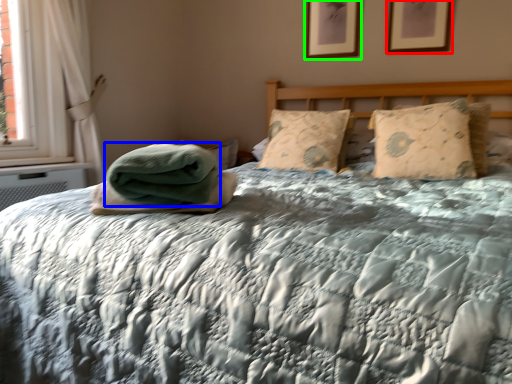
Question: Which object is the closest to the picture frame (highlighted by a red box)? Choose among these: material (highlighted by a blue box) or picture frame (highlighted by a green box).

Choices:
 (A) material
 (B) picture frame

Answer: (B)